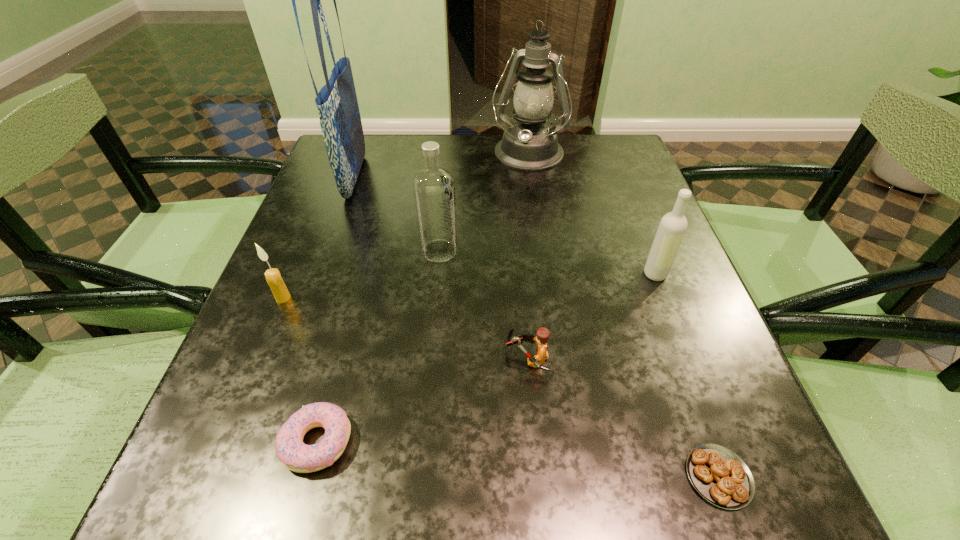
You are a GUI agent. You are given a task and a screenshot of the screen. Output one action in this format:
    pyautogui.click(x=<x>, y=<y>)
    Task: Click on the third nearest object
    This screenshot has width=960, height=540.
    Given the screenshot: What is the action you would take?
    pyautogui.click(x=542, y=335)

This screenshot has width=960, height=540. Find the location of `the third object from left to right`. the third object from left to right is located at coordinates (296, 456).

This screenshot has height=540, width=960. What are the coordinates of `the seventh tallest object` in the screenshot? It's located at (296, 456).

Locate an element on the screen. the shortest object is located at coordinates (720, 476).

Where is `vacant space located 0.270m on the front-facing side of the seventh object from right to left`? The image size is (960, 540). vacant space located 0.270m on the front-facing side of the seventh object from right to left is located at coordinates (475, 177).

Find the location of a particular element. free space located on the right of the oil lamp is located at coordinates (617, 156).

Locate an element on the screen. This screenshot has width=960, height=540. vacant region located 0.210m on the front label of the taller vodka is located at coordinates (562, 251).

Where is `vacant region located on the back of the nearer vodka`? The width and height of the screenshot is (960, 540). vacant region located on the back of the nearer vodka is located at coordinates (634, 218).

At what (x,y) coordinates should I click in order to perform the action: click on vacant position located 0.100m on the front of the leftmost object. Please return your answer as a coordinate pair (x, y). The height and width of the screenshot is (540, 960). Looking at the image, I should click on (262, 349).

The height and width of the screenshot is (540, 960). Find the location of `vacant space located holding a crossbow in the hands of the third shortest object`. vacant space located holding a crossbow in the hands of the third shortest object is located at coordinates (322, 358).